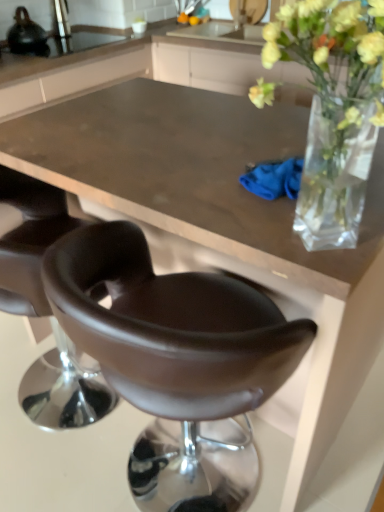
The image size is (384, 512). Describe the element at coordinates (46, 309) in the screenshot. I see `leather-like brown chair at lower left, which is the second chair from right to left` at that location.

How much space does brown leather chair at center, placed as the 1th chair when sorted from right to left, occupy horizontally?

It is 19.58 inches.

The width and height of the screenshot is (384, 512). Describe the element at coordinates (334, 108) in the screenshot. I see `translucent glass vase at upper right` at that location.

You are a GUI agent. You are given a task and a screenshot of the screen. Output one action in this format:
    pyautogui.click(x=<x>, y=<y>)
    Task: Click on the shiny black kettle at upper left
    
    Given the screenshot: What is the action you would take?
    point(26,34)

Is brown leather chair at center, which is the second chair from left to right, at the back of leather-like brown chair at lower left, which is the second chair from right to left?

That's not correct — leather-like brown chair at lower left, which is the second chair from right to left, is not looking away from brown leather chair at center, which is the second chair from left to right.

From a real-world perspective, which object rests below the other?

In real-world perspective, leather-like brown chair at lower left, which is the second chair from right to left, is lower.

What's the angular difference between leather-like brown chair at lower left, the first chair when ordered from left to right, and brown leather chair at center, placed as the 1th chair when sorted from right to left,'s facing directions?

leather-like brown chair at lower left, the first chair when ordered from left to right, and brown leather chair at center, placed as the 1th chair when sorted from right to left, are facing 0.000708 degrees away from each other.

Does leather-like brown chair at lower left, which is the second chair from right to left, have a lesser width compared to brown leather chair at center, placed as the 1th chair when sorted from right to left?

No.

From a real-world perspective, between brown leather chair at center, which is the second chair from left to right, and shiny black kettle at upper left, who is vertically lower?

brown leather chair at center, which is the second chair from left to right, is physically lower.

What's the angular difference between brown leather chair at center, placed as the 1th chair when sorted from right to left, and shiny black kettle at upper left's facing directions?

They differ by 90 degrees in their facing directions.

Does brown leather chair at center, which is the second chair from left to right, contain shiny black kettle at upper left?

Actually, shiny black kettle at upper left is outside brown leather chair at center, which is the second chair from left to right.

Is point (79, 275) more distant than point (34, 34)?

No, it is in front of (34, 34).

From a real-world perspective, is shiny black kettle at upper left above or below brown leather chair at center, placed as the 1th chair when sorted from right to left?

shiny black kettle at upper left is situated higher than brown leather chair at center, placed as the 1th chair when sorted from right to left, in the real world.

Visually, is shiny black kettle at upper left positioned to the left or to the right of brown leather chair at center, which is the second chair from left to right?

shiny black kettle at upper left is to the left of brown leather chair at center, which is the second chair from left to right.

Between shiny black kettle at upper left and brown leather chair at center, placed as the 1th chair when sorted from right to left, which one has larger size?

brown leather chair at center, placed as the 1th chair when sorted from right to left.

Is shiny black kettle at upper left far from brown leather chair at center, which is the second chair from left to right?

That's right, there is a large distance between shiny black kettle at upper left and brown leather chair at center, which is the second chair from left to right.

From the picture: From a real-world perspective, relative to translucent glass vase at upper right, is brown leather chair at center, placed as the 1th chair when sorted from right to left, vertically above or below?

From a real-world perspective, brown leather chair at center, placed as the 1th chair when sorted from right to left, is physically below translucent glass vase at upper right.

Are brown leather chair at center, which is the second chair from left to right, and translucent glass vase at upper right far apart?

brown leather chair at center, which is the second chair from left to right, is near translucent glass vase at upper right, not far away.

Where is `floral arrangement above the brown leather chair at center, which is the second chair from left to right (from the image's perspective)`? floral arrangement above the brown leather chair at center, which is the second chair from left to right (from the image's perspective) is located at coordinates (334, 108).

Between brown leather chair at center, placed as the 1th chair when sorted from right to left, and translucent glass vase at upper right, which one has larger size?

brown leather chair at center, placed as the 1th chair when sorted from right to left, is bigger.

From the image's perspective, is leather-like brown chair at lower left, which is the second chair from right to left, above or below translucent glass vase at upper right?

Based on their image positions, leather-like brown chair at lower left, which is the second chair from right to left, is located beneath translucent glass vase at upper right.

Can you tell me how much leather-like brown chair at lower left, the first chair when ordered from left to right, and translucent glass vase at upper right differ in facing direction?

The facing directions of leather-like brown chair at lower left, the first chair when ordered from left to right, and translucent glass vase at upper right are 179 degrees apart.

Does leather-like brown chair at lower left, the first chair when ordered from left to right, come in front of translucent glass vase at upper right?

No, it is not.

Is leather-like brown chair at lower left, which is the second chair from right to left, to the right of translucent glass vase at upper right from the viewer's perspective?

No, leather-like brown chair at lower left, which is the second chair from right to left, is not to the right of translucent glass vase at upper right.

Which of these two, brown leather chair at center, which is the second chair from left to right, or leather-like brown chair at lower left, the first chair when ordered from left to right, is smaller?

With smaller size is brown leather chair at center, which is the second chair from left to right.

Is leather-like brown chair at lower left, the first chair when ordered from left to right, at the back of brown leather chair at center, placed as the 1th chair when sorted from right to left?

No, brown leather chair at center, placed as the 1th chair when sorted from right to left,'s orientation is not away from leather-like brown chair at lower left, the first chair when ordered from left to right.

Is point (319, 106) closer or farther from the camera than point (38, 42)?

Point (319, 106) appears to be closer to the viewer than point (38, 42).

Where is `floral arrangement in front of the shiny black kettle at upper left`? The image size is (384, 512). floral arrangement in front of the shiny black kettle at upper left is located at coordinates (334, 108).

From the image's perspective, which one is positioned lower, translucent glass vase at upper right or shiny black kettle at upper left?

From the image's view, translucent glass vase at upper right is below.

Image resolution: width=384 pixels, height=512 pixels. Identify the location of chair that is in front of the leather-like brown chair at lower left, the first chair when ordered from left to right. (172, 347).

Identify the location of the 2nd chair counting from the right side of the shiny black kettle at upper left. point(172,347).

Looking at the image, which one is located further to shiny black kettle at upper left, brown leather chair at center, placed as the 1th chair when sorted from right to left, or translucent glass vase at upper right?

The object further to shiny black kettle at upper left is translucent glass vase at upper right.

Based on their spatial positions, is translucent glass vase at upper right or shiny black kettle at upper left further from leather-like brown chair at lower left, which is the second chair from right to left?

shiny black kettle at upper left lies further to leather-like brown chair at lower left, which is the second chair from right to left, than the other object.

Estimate the real-world distances between objects in this image. Which object is closer to translucent glass vase at upper right, shiny black kettle at upper left or leather-like brown chair at lower left, which is the second chair from right to left?

Based on the image, leather-like brown chair at lower left, which is the second chair from right to left, appears to be nearer to translucent glass vase at upper right.

Estimate the real-world distances between objects in this image. Which object is closer to shiny black kettle at upper left, translucent glass vase at upper right or brown leather chair at center, which is the second chair from left to right?

brown leather chair at center, which is the second chair from left to right, lies closer to shiny black kettle at upper left than the other object.

From the image, which object appears to be nearer to brown leather chair at center, placed as the 1th chair when sorted from right to left, shiny black kettle at upper left or leather-like brown chair at lower left, the first chair when ordered from left to right?

The object closer to brown leather chair at center, placed as the 1th chair when sorted from right to left, is leather-like brown chair at lower left, the first chair when ordered from left to right.

Estimate the real-world distances between objects in this image. Which object is closer to translucent glass vase at upper right, leather-like brown chair at lower left, the first chair when ordered from left to right, or brown leather chair at center, which is the second chair from left to right?

brown leather chair at center, which is the second chair from left to right, is closer to translucent glass vase at upper right.

Considering their positions, is brown leather chair at center, placed as the 1th chair when sorted from right to left, positioned closer to leather-like brown chair at lower left, the first chair when ordered from left to right, than shiny black kettle at upper left?

brown leather chair at center, placed as the 1th chair when sorted from right to left.

Based on their spatial positions, is leather-like brown chair at lower left, which is the second chair from right to left, or shiny black kettle at upper left closer to translucent glass vase at upper right?

leather-like brown chair at lower left, which is the second chair from right to left, is closer to translucent glass vase at upper right.

The width and height of the screenshot is (384, 512). Identify the location of chair between brown leather chair at center, placed as the 1th chair when sorted from right to left, and shiny black kettle at upper left, along the z-axis. (46, 309).

Where is `chair between leather-like brown chair at lower left, which is the second chair from right to left, and translucent glass vase at upper right`? chair between leather-like brown chair at lower left, which is the second chair from right to left, and translucent glass vase at upper right is located at coordinates (172, 347).